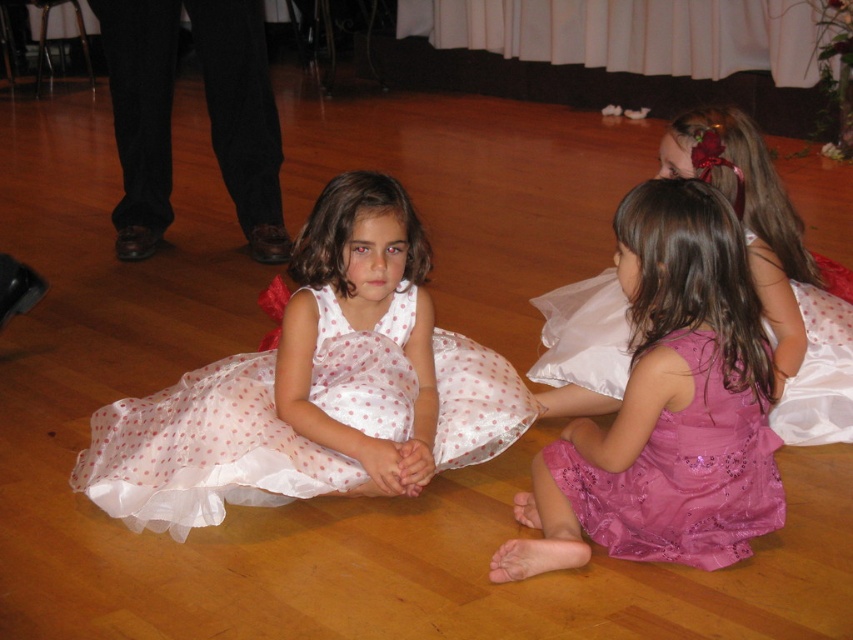
Question: Does pink sequined dress at lower right have a greater width compared to pink satin dress at lower right?

Choices:
 (A) yes
 (B) no

Answer: (A)

Question: Does pink sequined dress at lower right appear on the right side of pink satin dress at lower right?

Choices:
 (A) yes
 (B) no

Answer: (A)

Question: Where is pink sequined dress at lower right located in relation to pink satin dress at lower right in the image?

Choices:
 (A) left
 (B) right

Answer: (B)

Question: Which object appears closest to the camera in this image?

Choices:
 (A) white sheer dress at center
 (B) pink satin dress at lower right

Answer: (A)

Question: Which object is positioned farthest from the purple sequined dress at lower right?

Choices:
 (A) pink sequined dress at lower right
 (B) white sheer dress at center

Answer: (B)

Question: Which point is closer to the camera taking this photo?

Choices:
 (A) (567, 483)
 (B) (799, 412)
 (C) (534, 560)
 (D) (264, 442)

Answer: (C)